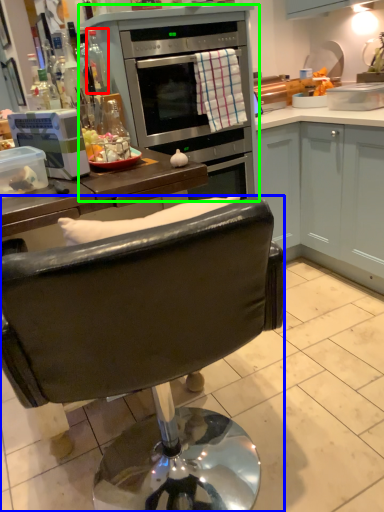
Question: Which object is the closest to the bottle (highlighted by a red box)? Choose among these: chair (highlighted by a blue box) or appliance (highlighted by a green box).

Choices:
 (A) chair
 (B) appliance

Answer: (B)